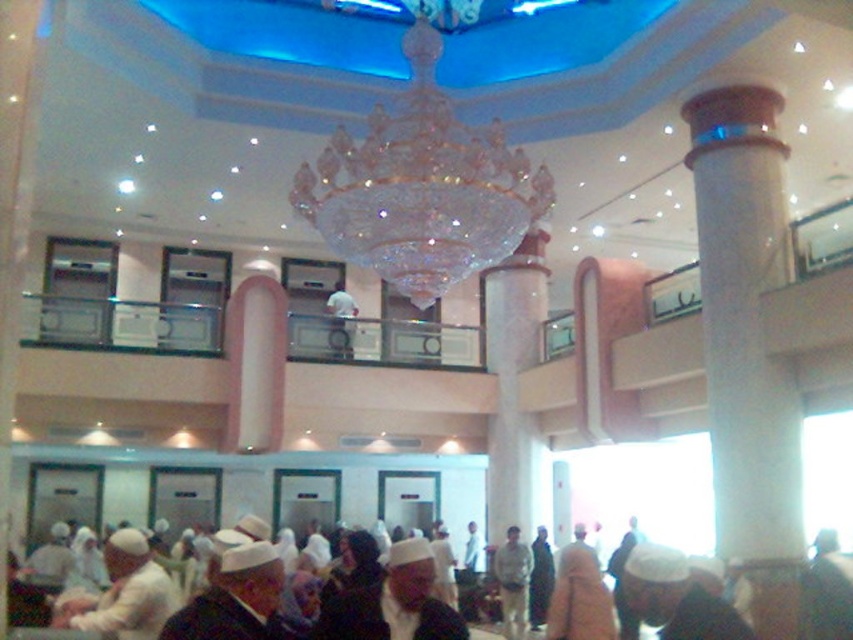
Is crystal glass chandelier at center bigger than white fabric hat at center?

Indeed, crystal glass chandelier at center has a larger size compared to white fabric hat at center.

Who is shorter, crystal glass chandelier at center or white fabric hat at center?

white fabric hat at center

Image resolution: width=853 pixels, height=640 pixels. Find the location of `crystal glass chandelier at center`. crystal glass chandelier at center is located at coordinates (421, 188).

Where is `dark brown leather jacket at lower right`? dark brown leather jacket at lower right is located at coordinates (827, 589).

Which of these two, dark brown leather jacket at lower right or white fabric shirt at upper center, stands taller?

dark brown leather jacket at lower right

This screenshot has height=640, width=853. What are the coordinates of `dark brown leather jacket at lower right` in the screenshot? It's located at (827, 589).

Find the location of `dark brown leather jacket at lower right`. dark brown leather jacket at lower right is located at coordinates (827, 589).

Is dark brown leather jacket at lower right smaller than dark blue fabric robe at lower center?

Actually, dark brown leather jacket at lower right might be larger than dark blue fabric robe at lower center.

Is point (840, 577) positioned before point (177, 632)?

That is False.

Based on the photo, who is more distant from viewer, (821, 614) or (189, 621)?

The point (821, 614) is more distant.

Locate an element on the screen. Image resolution: width=853 pixels, height=640 pixels. dark brown leather jacket at lower right is located at coordinates (827, 589).